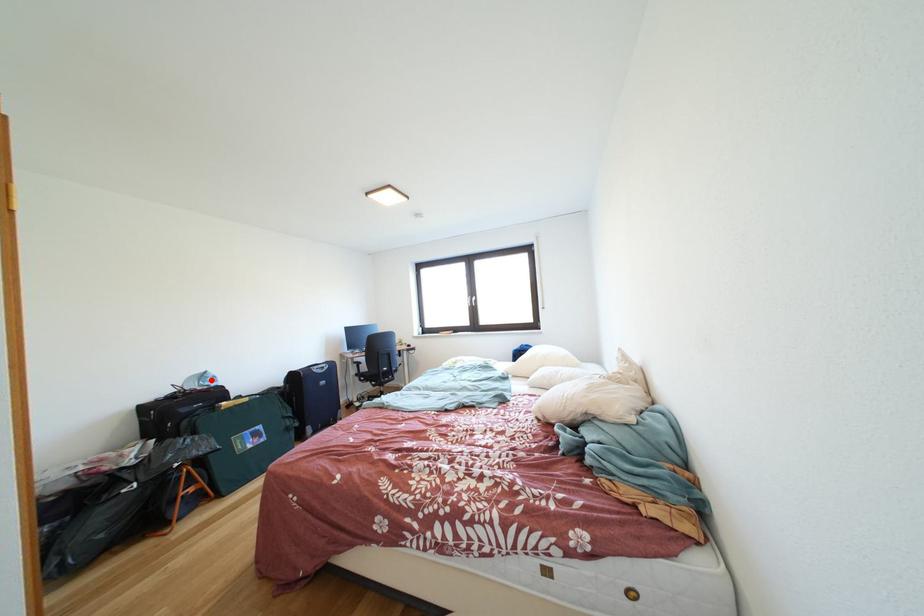
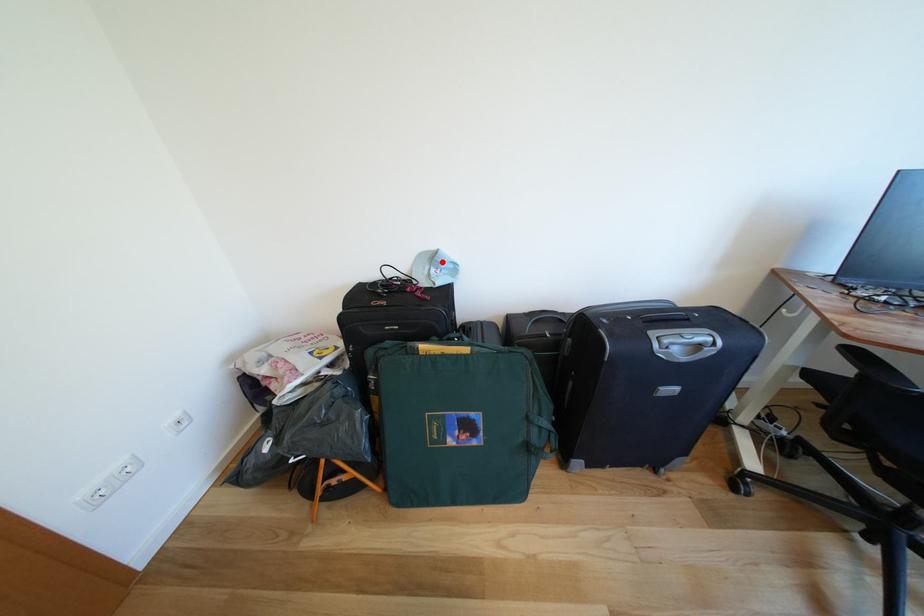
I am providing you with two images of the same scene from different viewpoints. A red point is marked on the first image and another point is marked on the second image. Does the point marked in image1 correspond to the same location as the one in image2?

Yes